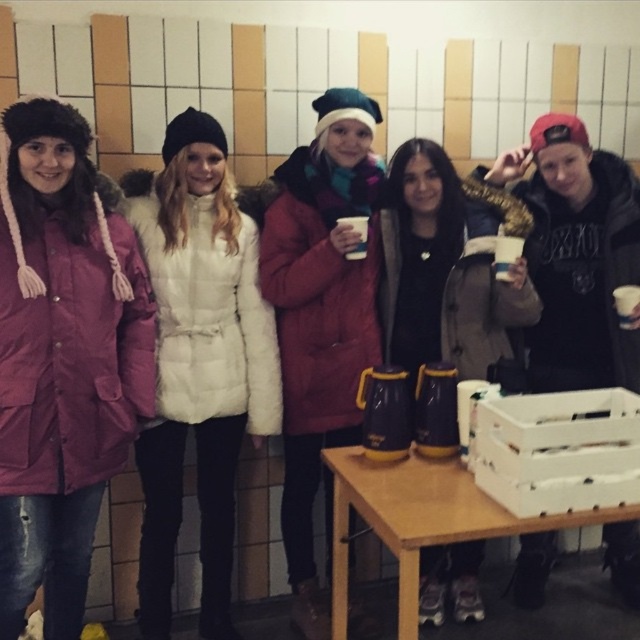
You are at a casual gathering and want to locate the black fuzzy hat at upper right and the matte black boots at center. Which object is positioned to the right of the other?

The black fuzzy hat at upper right is positioned to the right of the matte black boots at center.

You are a delivery person who just arrived at the scene with a small package. You need to place the package on either the white plastic crate at lower right or the wooden table at lower center. The package is 7 inches wide. Which surface can you safely place the package on without it overlapping?

The wooden table at lower center can safely hold the package since the distance between the white plastic crate at lower right and the wooden table at lower center is 6.73 inches, which is less than the package width. Therefore, the package cannot fit between them, so placing it on either surface would cause overlap. However, if the package must be placed on one of the surfaces, check the individual surface dimensions. Since the description only provides the distance between them, we cannot confirm the size